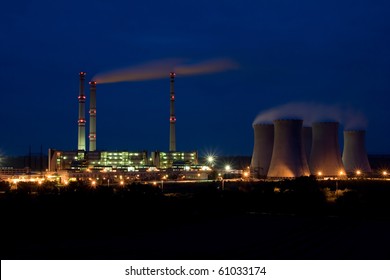
I want to click on yellow lights, so click(x=341, y=170), click(x=318, y=168).